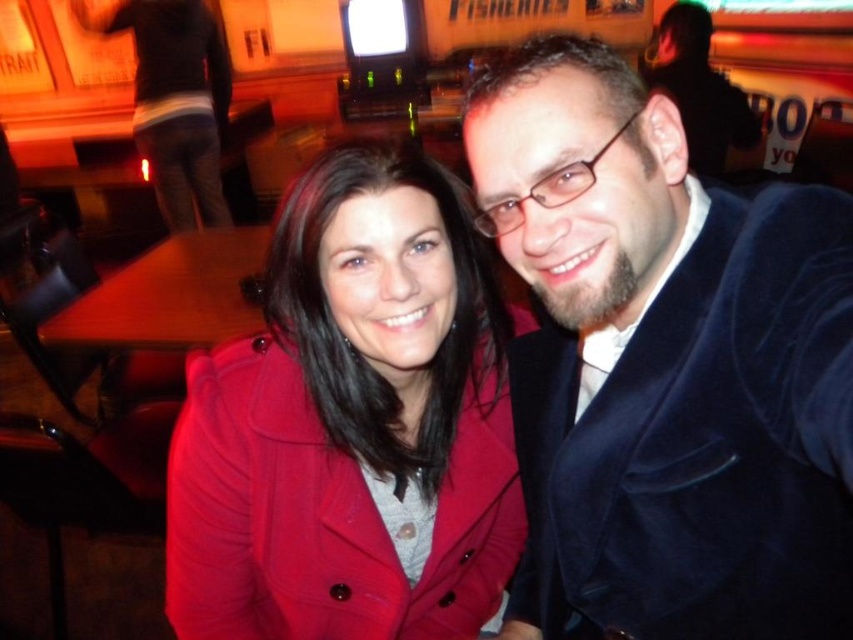
You are standing in the same room as the two people in the image. You want to take a photo of the velvet blue jacket at right without including the television screen in the upper middle. Which direction should you move relative to the point marked at coordinates point (666, 369)?

Move to the left of point (666, 369) to avoid the television screen in the upper middle and capture the velvet blue jacket at right in your photo.